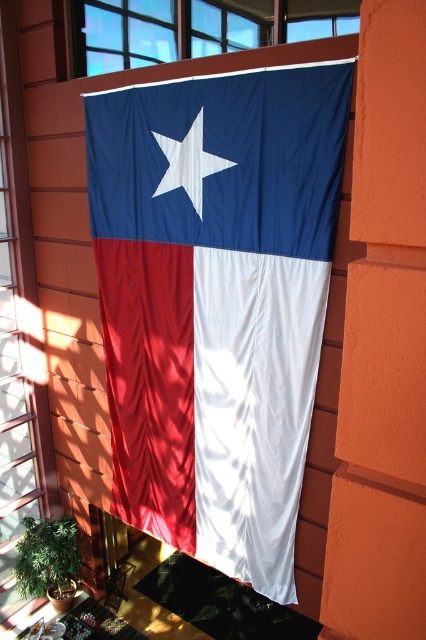
Question: Observing the image, what is the correct spatial positioning of transparent glass window at lower left in reference to white fabric star at center?

Choices:
 (A) below
 (B) above

Answer: (B)

Question: Which of the following is the farthest from the observer?

Choices:
 (A) white fabric star at center
 (B) matte fabric flag at center
 (C) transparent glass window at lower left
 (D) orange smooth wall at center

Answer: (C)

Question: Is matte fabric flag at center positioned before white fabric star at center?

Choices:
 (A) yes
 (B) no

Answer: (A)

Question: Does orange smooth wall at center come behind transparent glass window at upper center?

Choices:
 (A) no
 (B) yes

Answer: (A)

Question: Which point is farther from the camera taking this photo?

Choices:
 (A) pyautogui.click(x=348, y=342)
 (B) pyautogui.click(x=51, y=435)
 (C) pyautogui.click(x=167, y=113)

Answer: (B)

Question: Which of the following is the farthest from the observer?

Choices:
 (A) transparent glass window at upper center
 (B) matte fabric flag at center

Answer: (A)